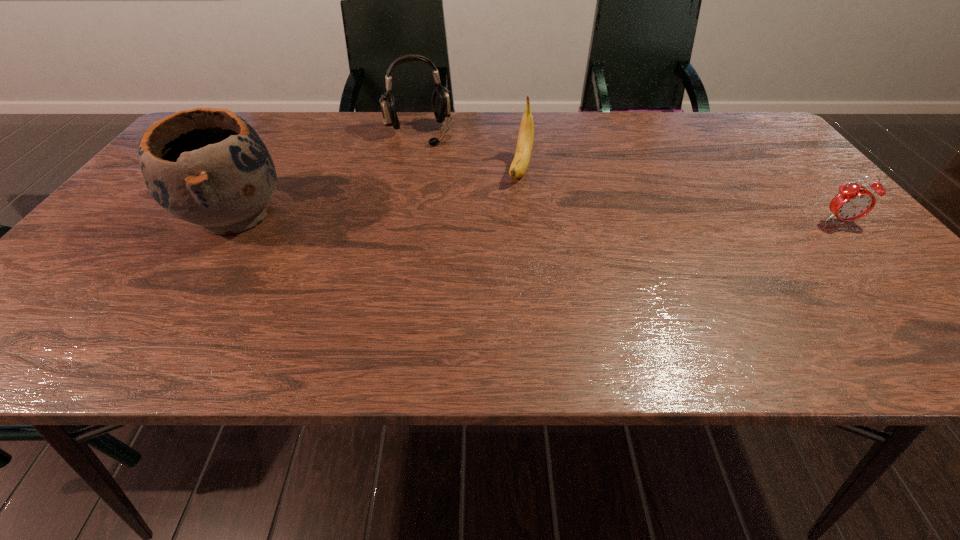
I want to click on blank space located at the start of the peel on the third tallest object, so (x=487, y=282).

Where is `free spot located 0.170m at the start of the peel on the third tallest object`? This screenshot has width=960, height=540. free spot located 0.170m at the start of the peel on the third tallest object is located at coordinates (505, 231).

The width and height of the screenshot is (960, 540). Identify the location of blank space located with the microphone on the side of the second object from left to right. (445, 186).

Where is `free location located with the microphone on the side of the second object from left to right`? The image size is (960, 540). free location located with the microphone on the side of the second object from left to right is located at coordinates (445, 186).

Locate an element on the screen. This screenshot has height=540, width=960. vacant space located 0.120m with the microphone on the side of the second object from left to right is located at coordinates (438, 170).

Find the location of a particular element. This screenshot has height=540, width=960. banana at the far edge is located at coordinates (524, 148).

At what (x,y) coordinates should I click in order to perform the action: click on headset located in the far edge section of the desktop. Please return your answer as a coordinate pair (x, y). This screenshot has height=540, width=960. Looking at the image, I should click on (440, 100).

Identify the location of object that is at the left edge. This screenshot has width=960, height=540. (207, 166).

Identify the location of object present at the right edge. This screenshot has width=960, height=540. (853, 201).

Image resolution: width=960 pixels, height=540 pixels. Find the location of `vacant space at the far edge of the desktop`. vacant space at the far edge of the desktop is located at coordinates (662, 116).